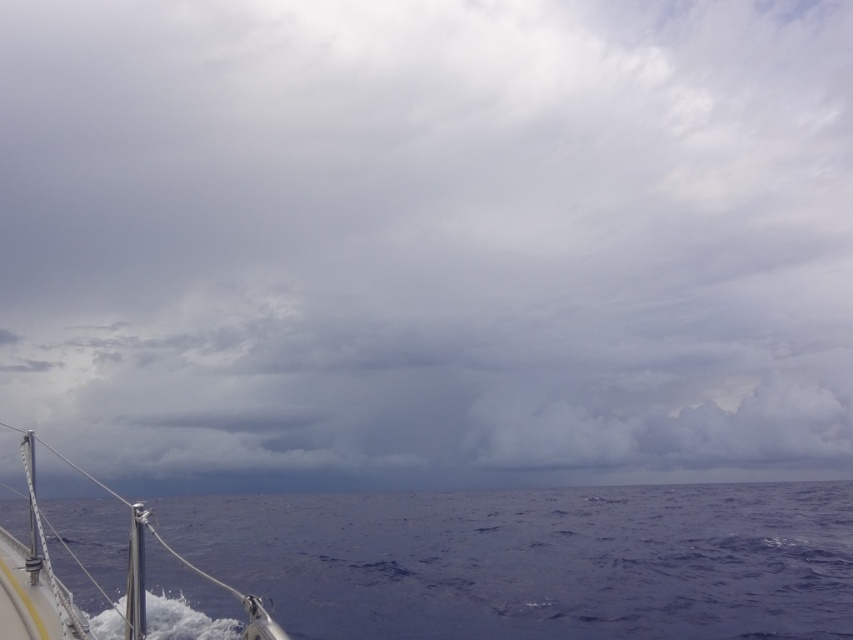
You are standing on the deck of the polished metal boat at lower left and want to jump into the deep blue water at lower center. Is the water surface lower or higher than the boat deck?

The deep blue water at lower center is shorter than the polished metal boat at lower left, which means the water surface is lower than the boat deck. Therefore, jumping into the water would require descending below the boat deck level.

You are standing on the boat and looking at the scene. There is a point marked at coordinates point (x=537, y=561). What does this point represent?

The point (x=537, y=561) represents the deep blue water at lower center.

Based on the photo, you are an observer on a ship looking out at the scene. You notice the deep blue water at lower center and the polished metal boat at lower left. Which object appears smaller in the image?

The deep blue water at lower center appears smaller in the image compared to the polished metal boat at lower left, as stated in the description.